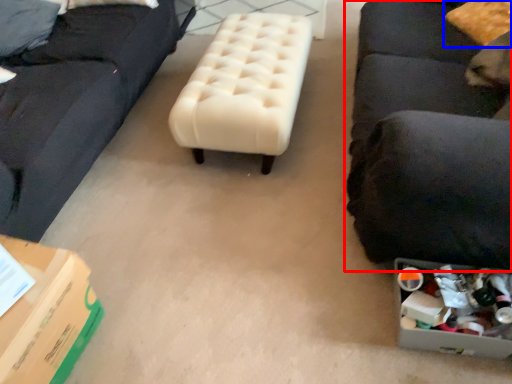
Question: Which of the following is the farthest to the observer, studio couch (highlighted by a red box) or pillow (highlighted by a blue box)?

Choices:
 (A) studio couch
 (B) pillow

Answer: (B)